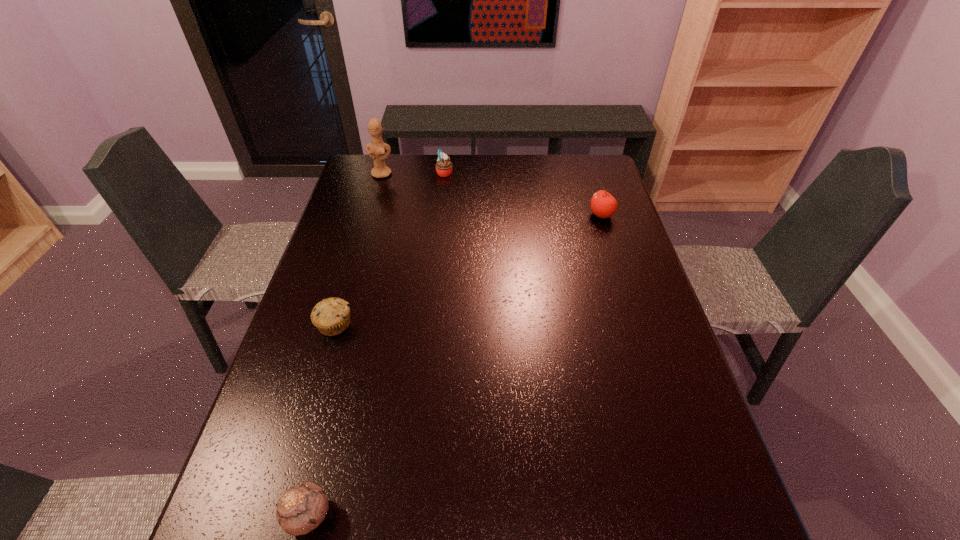
This screenshot has height=540, width=960. I want to click on the third closest muffin relative to the tallest object, so click(302, 508).

Identify the location of free space that satisfies the following two spatial constraints: 1. on the front-facing side of the rightmost muffin; 2. on the right side of the rightmost object. This screenshot has width=960, height=540. (440, 215).

The width and height of the screenshot is (960, 540). What are the coordinates of `free location that satisfies the following two spatial constraints: 1. on the front-facing side of the rightmost object; 2. on the left side of the farthest muffin` in the screenshot? It's located at (440, 215).

Image resolution: width=960 pixels, height=540 pixels. Identify the location of vacant area that satisfies the following two spatial constraints: 1. on the front-facing side of the farthest muffin; 2. on the front-facing side of the tallest object. (444, 174).